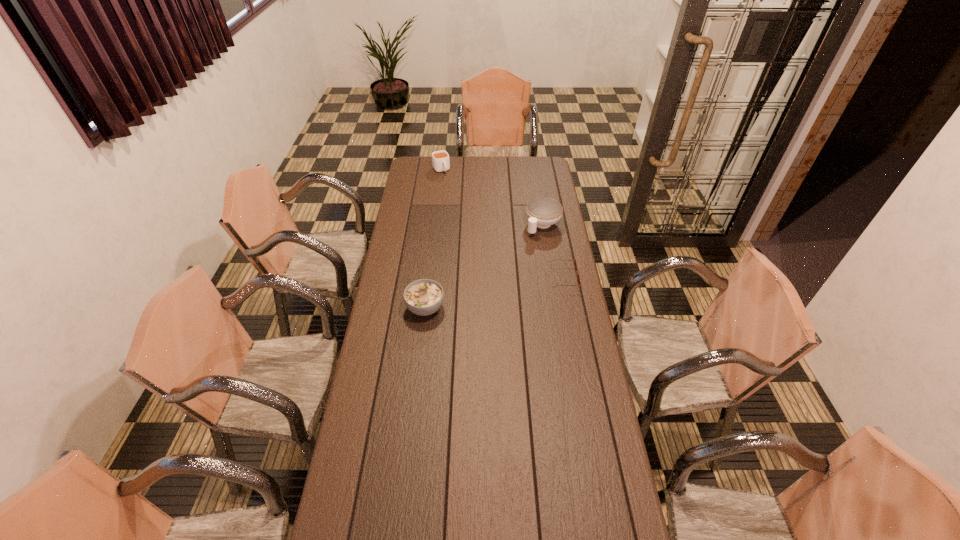
At what (x,y) coordinates should I click in order to perform the action: click on soup bowl. Please return your answer as a coordinate pair (x, y). This screenshot has height=540, width=960. Looking at the image, I should click on (423, 297).

What are the coordinates of `sunglasses` in the screenshot? It's located at coord(575,262).

Locate an element on the screen. the shortest object is located at coordinates (575, 262).

At what (x,y) coordinates should I click in order to perform the action: click on chinaware. Please return your answer as a coordinate pair (x, y). Looking at the image, I should click on (542, 212).

Image resolution: width=960 pixels, height=540 pixels. I want to click on cup, so click(440, 159).

The width and height of the screenshot is (960, 540). In order to click on vacant space located on the right of the soup bowl in this screenshot , I will do `click(529, 308)`.

At what (x,y) coordinates should I click in order to perform the action: click on vacant position located on the side with the handle of the third nearest object. Please return your answer as a coordinate pair (x, y). The width and height of the screenshot is (960, 540). Looking at the image, I should click on (509, 264).

You are a GUI agent. You are given a task and a screenshot of the screen. Output one action in this format:
    pyautogui.click(x=<x>, y=<y>)
    Task: Click on the vacant space located on the side with the handle of the third nearest object
    This screenshot has width=960, height=540.
    Given the screenshot: What is the action you would take?
    click(514, 259)

I want to click on vacant space located on the side with the handle of the third nearest object, so click(499, 274).

Where is `free spot located on the side with the handle of the farthest object`? This screenshot has width=960, height=540. free spot located on the side with the handle of the farthest object is located at coordinates [x=462, y=204].